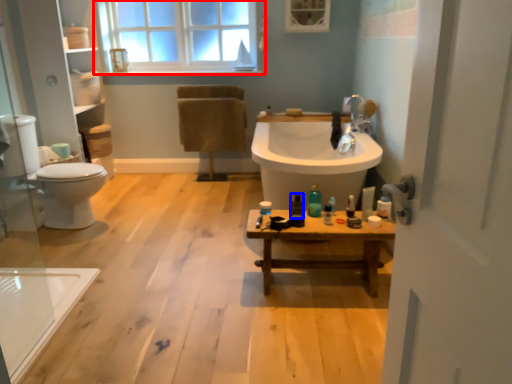
Question: Which object appears farthest to the camera in this image, window (highlighted by a red box) or toiletry (highlighted by a blue box)?

Choices:
 (A) window
 (B) toiletry

Answer: (A)